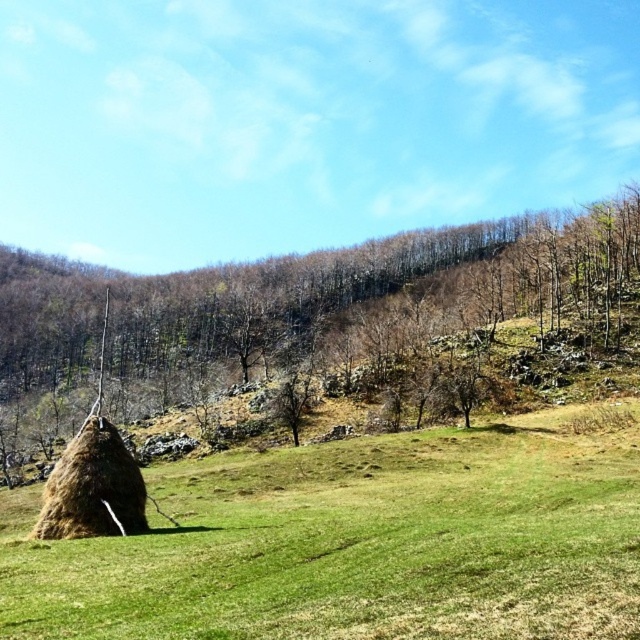
You are a farmer checking the field. You notice the green grassy field at lower left and the brown textured hay at lower left. Which area covers a smaller portion of the ground?

The green grassy field at lower left occupies less space than the brown textured hay at lower left, so the green grassy field at lower left covers a smaller portion of the ground.

You are standing in the rural landscape scene and want to place a small flag at each of the two points, point (116, 637) and point (339, 259). Which point will have its flag appear closer to you when viewed from your current position?

Point (116, 637) will have its flag appear closer to you because it is closer to the viewer than point (339, 259).

You are a gardener examining the green grassy field at lower left and the brown textured hay at lower left. Which of these two has a greater height?

The brown textured hay at lower left is taller than the green grassy field at lower left.